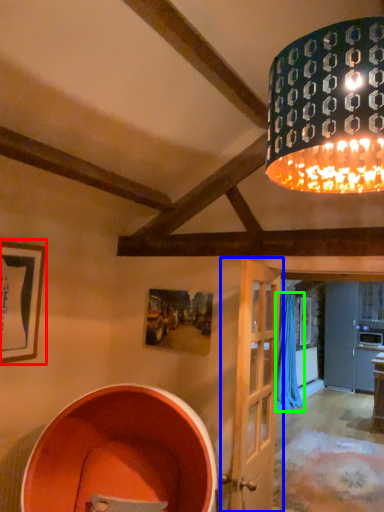
Question: Which object is the closest to the picture frame (highlighted by a red box)? Choose among these: door (highlighted by a blue box) or curtain (highlighted by a green box).

Choices:
 (A) door
 (B) curtain

Answer: (A)